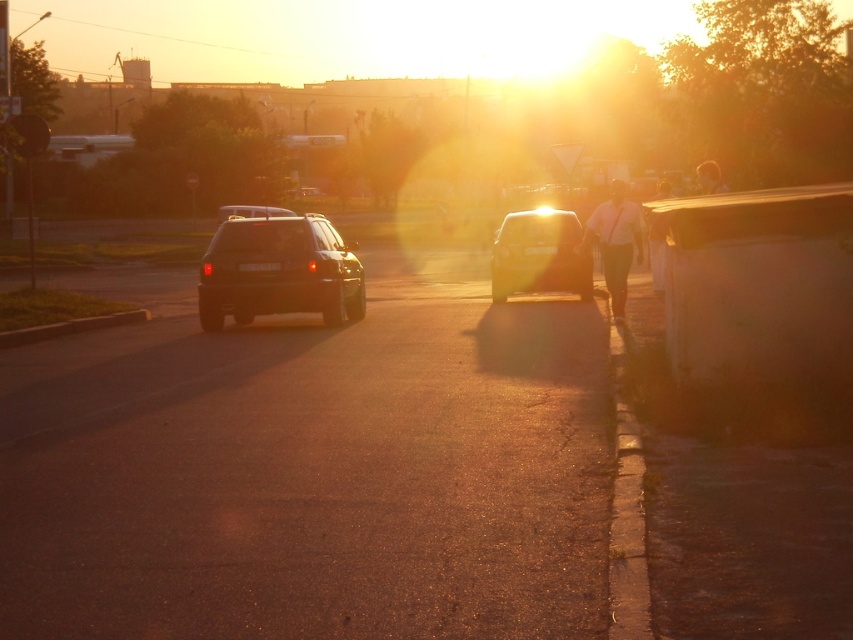
Question: Is smooth white shirt at center wider than satin black car at center?

Choices:
 (A) yes
 (B) no

Answer: (A)

Question: Does satin black car at center come in front of smooth skin face at right?

Choices:
 (A) no
 (B) yes

Answer: (A)

Question: Among these objects, which one is nearest to the camera?

Choices:
 (A) smooth white shirt at center
 (B) satin black suv at center

Answer: (A)

Question: Does satin black suv at center appear over smooth white shirt at center?

Choices:
 (A) no
 (B) yes

Answer: (A)

Question: Among these points, which one is farthest from the camera?

Choices:
 (A) (625, 218)
 (B) (225, 211)
 (C) (229, 234)
 (D) (654, 221)

Answer: (B)

Question: Based on their relative distances, which object is nearer to the satin black suv at center?

Choices:
 (A) smooth white shirt at center
 (B) white fabric shirt at center-right

Answer: (B)